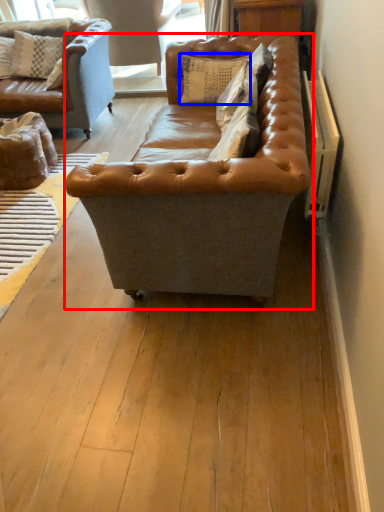
Question: Which point is further to the camera, studio couch (highlighted by a red box) or pillow (highlighted by a blue box)?

Choices:
 (A) studio couch
 (B) pillow

Answer: (B)